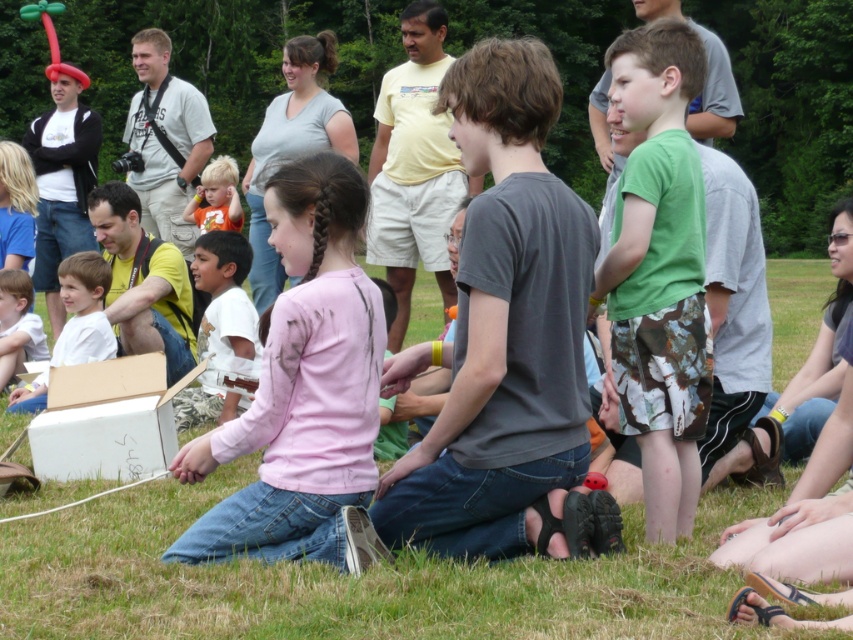
Question: Among these points, which one is farthest from the camera?

Choices:
 (A) (231, 236)
 (B) (221, 156)

Answer: (B)

Question: Does pink matte shirt at center appear over white cotton shirt at center?

Choices:
 (A) no
 (B) yes

Answer: (A)

Question: Does green grass at center have a smaller size compared to white cotton shirt at center?

Choices:
 (A) yes
 (B) no

Answer: (B)

Question: Among these objects, which one is farthest from the camera?

Choices:
 (A) white cotton shirt at lower left
 (B) green grass at center

Answer: (A)

Question: Among these points, which one is farthest from the camera?

Choices:
 (A) (33, 396)
 (B) (677, 488)
 (C) (318, 493)
 (D) (489, 573)

Answer: (A)

Question: Considering the relative positions of green cotton shirt at center and white cotton shirt at center in the image provided, where is green cotton shirt at center located with respect to white cotton shirt at center?

Choices:
 (A) left
 (B) right

Answer: (B)